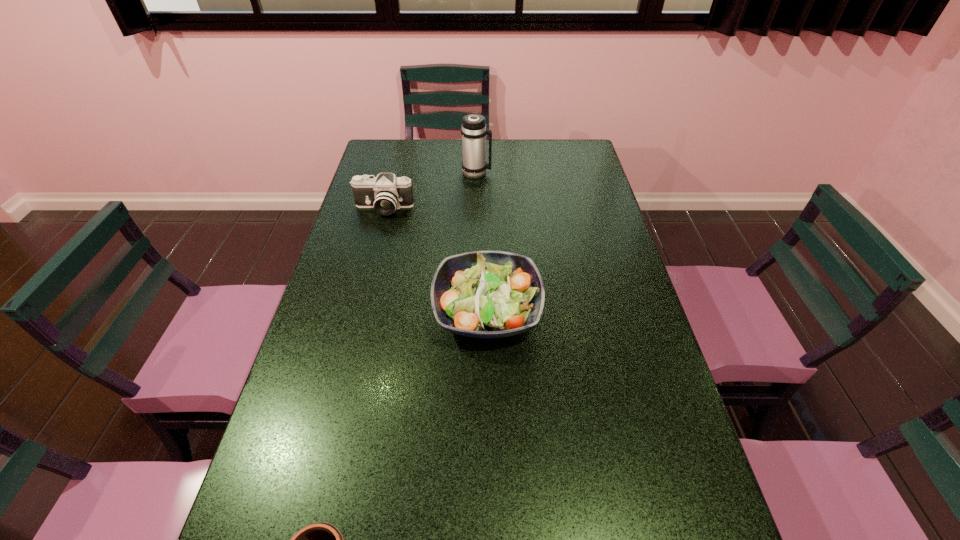
At what (x,y) coordinates should I click in order to perform the action: click on the farthest object. Please return your answer as a coordinate pair (x, y). Image resolution: width=960 pixels, height=540 pixels. Looking at the image, I should click on (473, 130).

Image resolution: width=960 pixels, height=540 pixels. I want to click on the tallest object, so click(473, 130).

At what (x,y) coordinates should I click in order to perform the action: click on the third nearest object. Please return your answer as a coordinate pair (x, y). Looking at the image, I should click on (385, 193).

At what (x,y) coordinates should I click in order to perform the action: click on salad plate. Please return your answer as a coordinate pair (x, y). Looking at the image, I should click on (482, 294).

At what (x,y) coordinates should I click in order to perform the action: click on free space located 0.300m on the side with the handle of the farthest object. Please return your answer as a coordinate pair (x, y). The image size is (960, 540). Looking at the image, I should click on (570, 172).

Locate an element on the screen. This screenshot has height=540, width=960. free space located on the right of the camera is located at coordinates (512, 208).

Find the location of a particular element. This screenshot has width=960, height=540. free space located 0.220m on the back of the salad plate is located at coordinates click(x=486, y=226).

Find the location of `object that is at the far edge`. object that is at the far edge is located at coordinates (473, 130).

Identify the location of object that is at the left edge. The height and width of the screenshot is (540, 960). (385, 193).

Locate an element on the screen. The height and width of the screenshot is (540, 960). free region at the far edge is located at coordinates (517, 144).